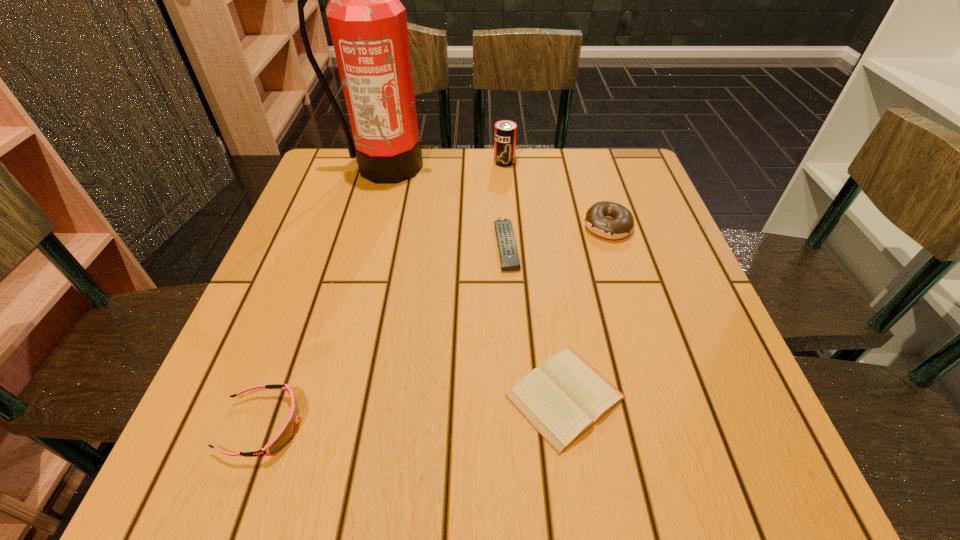
The image size is (960, 540). I want to click on unoccupied position between the fifth shortest object and the tallest object, so click(444, 164).

I want to click on vacant point located between the fire extinguisher and the remote control, so click(x=445, y=206).

This screenshot has width=960, height=540. In order to click on blank region between the remote control and the fire extinguisher in this screenshot , I will do `click(445, 206)`.

I want to click on vacant point located between the goggles and the diary, so click(x=414, y=411).

I want to click on unoccupied position between the goggles and the diary, so click(414, 411).

The image size is (960, 540). Identify the location of free space between the fifth shortest object and the goggles. (383, 293).

At what (x,y) coordinates should I click in order to perform the action: click on free area in between the remote control and the fifth shortest object. Please return your answer as a coordinate pair (x, y). Looking at the image, I should click on (505, 204).

This screenshot has height=540, width=960. What are the coordinates of `object that is the fifth closest to the tallest object` in the screenshot? It's located at (287, 432).

Locate which object is the fifth closest to the remote control. Please provide its 2D coordinates. Your answer should be formatted as a tuple, i.e. [(x, y)], where the tuple contains the x and y coordinates of a point satisfying the conditions above.

[(287, 432)]

Where is `vacant region that satisfies the following two spatial constraints: 1. on the front side of the remote control; 2. on the left side of the fire extinguisher`? This screenshot has height=540, width=960. vacant region that satisfies the following two spatial constraints: 1. on the front side of the remote control; 2. on the left side of the fire extinguisher is located at coordinates (362, 245).